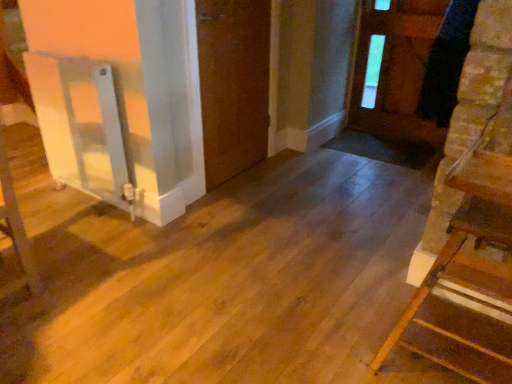
Question: Could wooden staircase at right be considered to be inside brown matte door at center, acting as the 2th door starting from the right?

Choices:
 (A) yes
 (B) no

Answer: (B)

Question: Can you confirm if brown matte door at center, acting as the 2th door starting from the right, is bigger than wooden staircase at right?

Choices:
 (A) no
 (B) yes

Answer: (A)

Question: Can you confirm if brown matte door at center, acting as the 2th door starting from the right, is taller than wooden staircase at right?

Choices:
 (A) no
 (B) yes

Answer: (B)

Question: From the image's perspective, is brown matte door at center, which is the 1th door from left to right, on wooden staircase at right?

Choices:
 (A) no
 (B) yes

Answer: (B)

Question: Is brown matte door at center, acting as the 2th door starting from the right, not within wooden staircase at right?

Choices:
 (A) yes
 (B) no

Answer: (A)

Question: From their relative heights in the image, would you say brown wooden door at upper right, which appears as the first door when viewed from the right, is taller or shorter than brown matte door at center, which is the 1th door from left to right?

Choices:
 (A) short
 (B) tall

Answer: (A)

Question: Looking at the image, does brown wooden door at upper right, marked as the 2th door in a left-to-right arrangement, seem bigger or smaller compared to brown matte door at center, acting as the 2th door starting from the right?

Choices:
 (A) small
 (B) big

Answer: (A)

Question: From the image's perspective, relative to brown matte door at center, acting as the 2th door starting from the right, is brown wooden door at upper right, which appears as the first door when viewed from the right, above or below?

Choices:
 (A) below
 (B) above

Answer: (B)

Question: Considering the relative positions of brown wooden door at upper right, which appears as the first door when viewed from the right, and brown matte door at center, which is the 1th door from left to right, in the image provided, is brown wooden door at upper right, which appears as the first door when viewed from the right, to the left or to the right of brown matte door at center, which is the 1th door from left to right,?

Choices:
 (A) left
 (B) right

Answer: (B)

Question: Is brown matte door at center, which is the 1th door from left to right, taller or shorter than brown wooden door at upper right, marked as the 2th door in a left-to-right arrangement?

Choices:
 (A) short
 (B) tall

Answer: (B)

Question: Is point (258, 137) closer or farther from the camera than point (415, 134)?

Choices:
 (A) closer
 (B) farther

Answer: (A)

Question: Considering the relative positions of brown matte door at center, which is the 1th door from left to right, and brown wooden door at upper right, marked as the 2th door in a left-to-right arrangement, in the image provided, is brown matte door at center, which is the 1th door from left to right, to the left or to the right of brown wooden door at upper right, marked as the 2th door in a left-to-right arrangement,?

Choices:
 (A) left
 (B) right

Answer: (A)

Question: Which is correct: brown matte door at center, acting as the 2th door starting from the right, is inside brown wooden door at upper right, which appears as the first door when viewed from the right, or outside of it?

Choices:
 (A) outside
 (B) inside

Answer: (A)

Question: Is brown wooden door at upper right, which appears as the first door when viewed from the right, to the left or to the right of wooden staircase at right in the image?

Choices:
 (A) left
 (B) right

Answer: (B)

Question: From a real-world perspective, is brown wooden door at upper right, which appears as the first door when viewed from the right, positioned above or below wooden staircase at right?

Choices:
 (A) below
 (B) above

Answer: (B)